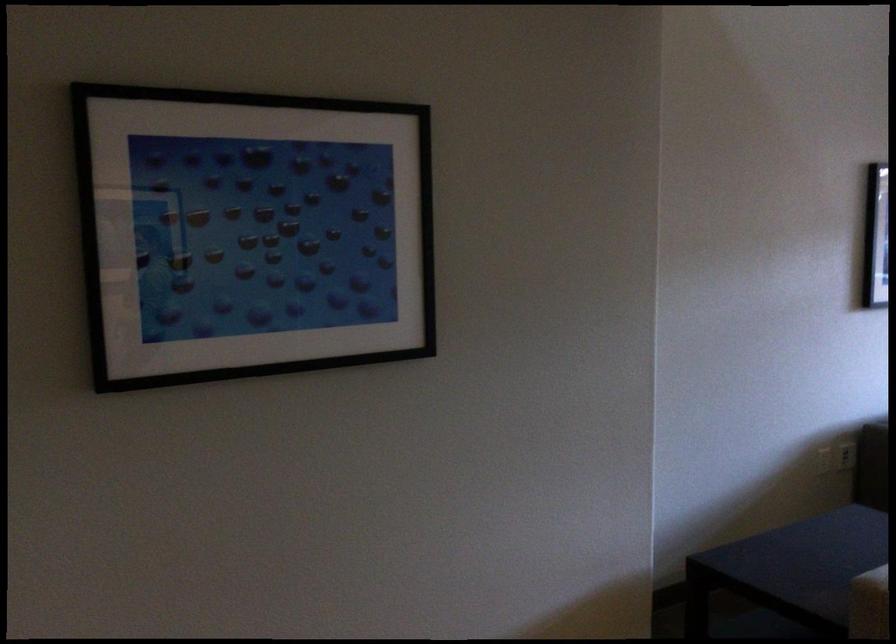
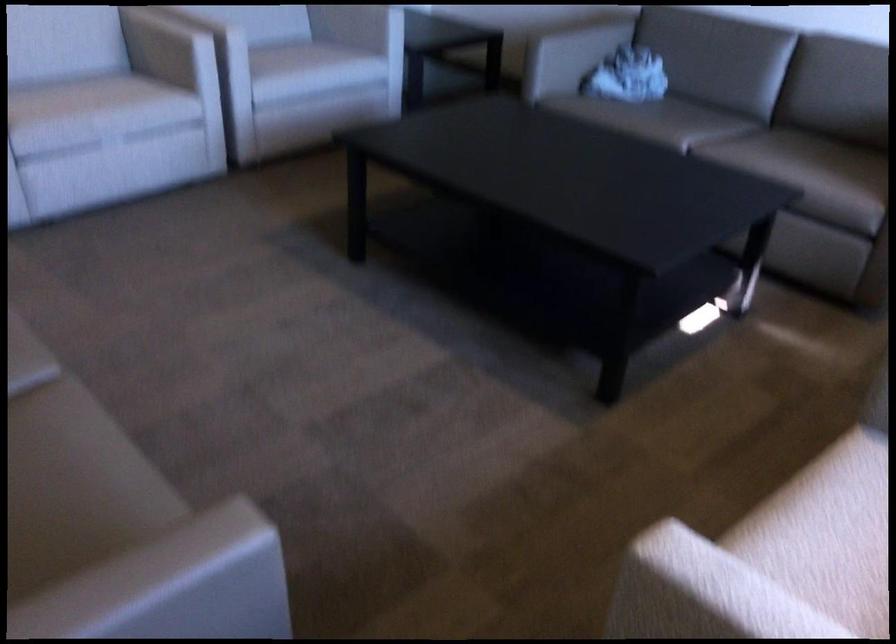
Locate, in the second image, the point that corresponds to point 763,457 in the first image.

(556, 26)